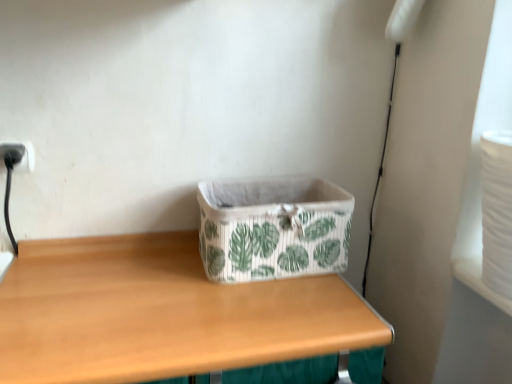
In order to face white fabric storage box at center, should I rotate leftwards or rightwards?

Rotate right and turn 2.682 degrees.

Image resolution: width=512 pixels, height=384 pixels. What do you see at coordinates (273, 228) in the screenshot?
I see `white fabric storage box at center` at bounding box center [273, 228].

At what (x,y) coordinates should I click in order to perform the action: click on wooden table at center. Please return your answer as a coordinate pair (x, y). This screenshot has width=512, height=384. Looking at the image, I should click on (162, 313).

The width and height of the screenshot is (512, 384). Identify the location of black plastic electric outlet at upper left. (18, 155).

Where is `white fabric storage box at center`? The width and height of the screenshot is (512, 384). white fabric storage box at center is located at coordinates (273, 228).

Is black plastic electric outlet at upper left at the back of white fabric storage box at center?

No.

From the image's perspective, is white fabric storage box at center above or below black plastic electric outlet at upper left?

white fabric storage box at center is below black plastic electric outlet at upper left.

In order to click on storage box in front of the black plastic electric outlet at upper left in this screenshot , I will do `click(273, 228)`.

Does wooden table at center have a greater width compared to black plastic electric outlet at upper left?

Indeed, wooden table at center has a greater width compared to black plastic electric outlet at upper left.

What's the angular difference between wooden table at center and black plastic electric outlet at upper left's facing directions?

The facing directions of wooden table at center and black plastic electric outlet at upper left are 0.0122 degrees apart.

Visually, is wooden table at center positioned to the left or to the right of black plastic electric outlet at upper left?

In the image, wooden table at center appears on the right side of black plastic electric outlet at upper left.

Which is correct: wooden table at center is inside white fabric storage box at center, or outside of it?

wooden table at center is outside white fabric storage box at center.

Is wooden table at center wider or thinner than white fabric storage box at center?

wooden table at center is wider than white fabric storage box at center.

Is wooden table at center to the left of white fabric storage box at center from the viewer's perspective?

Indeed, wooden table at center is positioned on the left side of white fabric storage box at center.

Can we say black plastic electric outlet at upper left lies outside white fabric storage box at center?

Absolutely, black plastic electric outlet at upper left is external to white fabric storage box at center.

In terms of size, does black plastic electric outlet at upper left appear bigger or smaller than white fabric storage box at center?

In the image, black plastic electric outlet at upper left appears to be smaller than white fabric storage box at center.

Can you confirm if black plastic electric outlet at upper left is shorter than white fabric storage box at center?

Yes, black plastic electric outlet at upper left is shorter than white fabric storage box at center.

Based on the photo, considering the relative positions of black plastic electric outlet at upper left and white fabric storage box at center in the image provided, is black plastic electric outlet at upper left to the left of white fabric storage box at center from the viewer's perspective?

Indeed, black plastic electric outlet at upper left is positioned on the left side of white fabric storage box at center.

From the picture: In terms of width, does white fabric storage box at center look wider or thinner when compared to wooden table at center?

In the image, white fabric storage box at center appears to be more narrow than wooden table at center.

How distant is white fabric storage box at center from wooden table at center?

white fabric storage box at center is 7.26 inches away from wooden table at center.

Does white fabric storage box at center have a greater height compared to wooden table at center?

In fact, white fabric storage box at center may be shorter than wooden table at center.

Considering the positions of objects white fabric storage box at center and wooden table at center in the image provided, who is in front, white fabric storage box at center or wooden table at center?

wooden table at center.

From a real-world perspective, relative to wooden table at center, is black plastic electric outlet at upper left vertically above or below?

From a real-world perspective, black plastic electric outlet at upper left is physically above wooden table at center.

Are black plastic electric outlet at upper left and wooden table at center making contact?

black plastic electric outlet at upper left is not next to wooden table at center, and they're not touching.

Is wooden table at center at the back of black plastic electric outlet at upper left?

No, wooden table at center is not at the back of black plastic electric outlet at upper left.

From the image's perspective, is black plastic electric outlet at upper left on wooden table at center?

Yes, from the image's perspective, black plastic electric outlet at upper left is over wooden table at center.

Where is `storage box directly beneath the black plastic electric outlet at upper left (from a real-world perspective)`? storage box directly beneath the black plastic electric outlet at upper left (from a real-world perspective) is located at coordinates (273, 228).

This screenshot has height=384, width=512. In order to click on electric outlet lying behind the wooden table at center in this screenshot , I will do (18, 155).

From the image, which object appears to be farther from wooden table at center, black plastic electric outlet at upper left or white fabric storage box at center?

The object further to wooden table at center is black plastic electric outlet at upper left.

Which object lies further to the anchor point white fabric storage box at center, wooden table at center or black plastic electric outlet at upper left?

black plastic electric outlet at upper left.

Looking at the image, which one is located closer to white fabric storage box at center, black plastic electric outlet at upper left or wooden table at center?

wooden table at center.

Looking at the image, which one is located closer to black plastic electric outlet at upper left, wooden table at center or white fabric storage box at center?

wooden table at center is positioned closer to the anchor black plastic electric outlet at upper left.

Considering their positions, is white fabric storage box at center positioned further to black plastic electric outlet at upper left than wooden table at center?

Based on the image, white fabric storage box at center appears to be further to black plastic electric outlet at upper left.

Which object lies further to the anchor point wooden table at center, white fabric storage box at center or black plastic electric outlet at upper left?

black plastic electric outlet at upper left is further to wooden table at center.

Identify the location of table between black plastic electric outlet at upper left and white fabric storage box at center from left to right. The height and width of the screenshot is (384, 512). (162, 313).